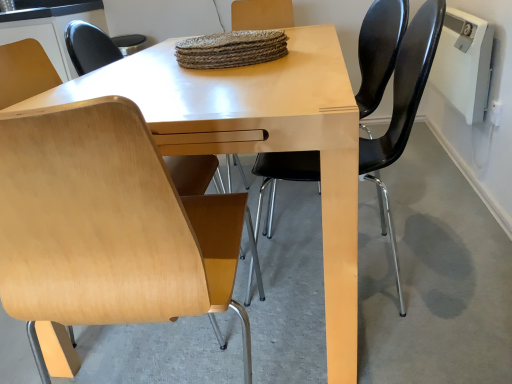
Question: Is beech wood chair at lower left at the left side of beech wood chair at left, which is counted as the 2th chair, starting from the right?

Choices:
 (A) yes
 (B) no

Answer: (B)

Question: Is beech wood chair at lower left located outside beech wood chair at left, which is counted as the 2th chair, starting from the right?

Choices:
 (A) yes
 (B) no

Answer: (A)

Question: Considering the relative positions of beech wood chair at lower left and beech wood chair at left, placed as the first chair when sorted from left to right, in the image provided, is beech wood chair at lower left in front of beech wood chair at left, placed as the first chair when sorted from left to right,?

Choices:
 (A) yes
 (B) no

Answer: (B)

Question: Is beech wood chair at lower left looking in the opposite direction of beech wood chair at left, which is counted as the 2th chair, starting from the right?

Choices:
 (A) no
 (B) yes

Answer: (A)

Question: Would you consider beech wood chair at lower left to be distant from beech wood chair at left, placed as the first chair when sorted from left to right?

Choices:
 (A) no
 (B) yes

Answer: (A)

Question: Would you say black leather chair at right, which appears as the first chair when viewed from the right, is to the left or to the right of beech wood chair at left, which is counted as the 2th chair, starting from the right, in the picture?

Choices:
 (A) left
 (B) right

Answer: (B)

Question: Is black leather chair at right, which appears as the first chair when viewed from the right, in front of or behind beech wood chair at left, placed as the first chair when sorted from left to right, in the image?

Choices:
 (A) behind
 (B) front

Answer: (A)

Question: Based on their sizes in the image, would you say black leather chair at right, positioned as the second chair in left-to-right order, is bigger or smaller than beech wood chair at left, which is counted as the 2th chair, starting from the right?

Choices:
 (A) big
 (B) small

Answer: (B)

Question: From a real-world perspective, relative to beech wood chair at left, placed as the first chair when sorted from left to right, is black leather chair at right, positioned as the second chair in left-to-right order, vertically above or below?

Choices:
 (A) above
 (B) below

Answer: (A)

Question: Looking at the image, does beech wood chair at lower left seem bigger or smaller compared to black leather chair at right, positioned as the second chair in left-to-right order?

Choices:
 (A) small
 (B) big

Answer: (A)

Question: Considering the positions of beech wood chair at lower left and black leather chair at right, which appears as the first chair when viewed from the right, in the image, is beech wood chair at lower left taller or shorter than black leather chair at right, which appears as the first chair when viewed from the right,?

Choices:
 (A) tall
 (B) short

Answer: (B)

Question: Does point (208, 369) appear closer or farther from the camera than point (268, 210)?

Choices:
 (A) farther
 (B) closer

Answer: (B)

Question: Relative to black leather chair at right, which appears as the first chair when viewed from the right, is beech wood chair at lower left in front or behind?

Choices:
 (A) front
 (B) behind

Answer: (B)

Question: Visually, is black leather chair at right, positioned as the second chair in left-to-right order, positioned to the left or to the right of beech wood chair at lower left?

Choices:
 (A) left
 (B) right

Answer: (B)

Question: Considering the positions of point (288, 152) and point (102, 326), is point (288, 152) closer or farther from the camera than point (102, 326)?

Choices:
 (A) farther
 (B) closer

Answer: (B)